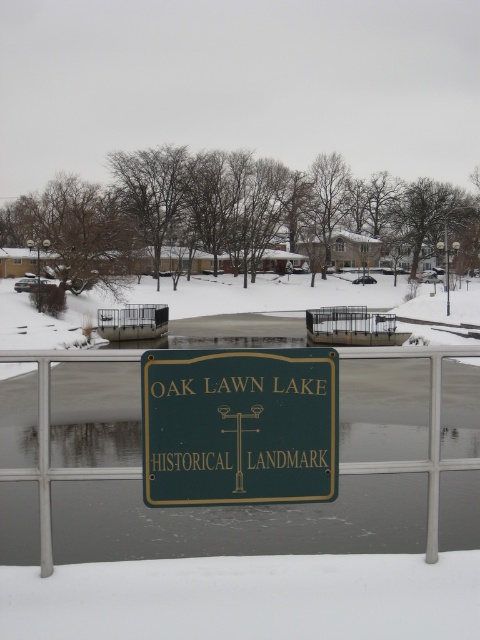
Between green polished wood sign at center and green metal sign at center, which one appears on the right side from the viewer's perspective?

green polished wood sign at center

Is point (182, 506) positioned after point (355, 352)?

No, it is not.

Where is `green polished wood sign at center`? Image resolution: width=480 pixels, height=640 pixels. green polished wood sign at center is located at coordinates (239, 426).